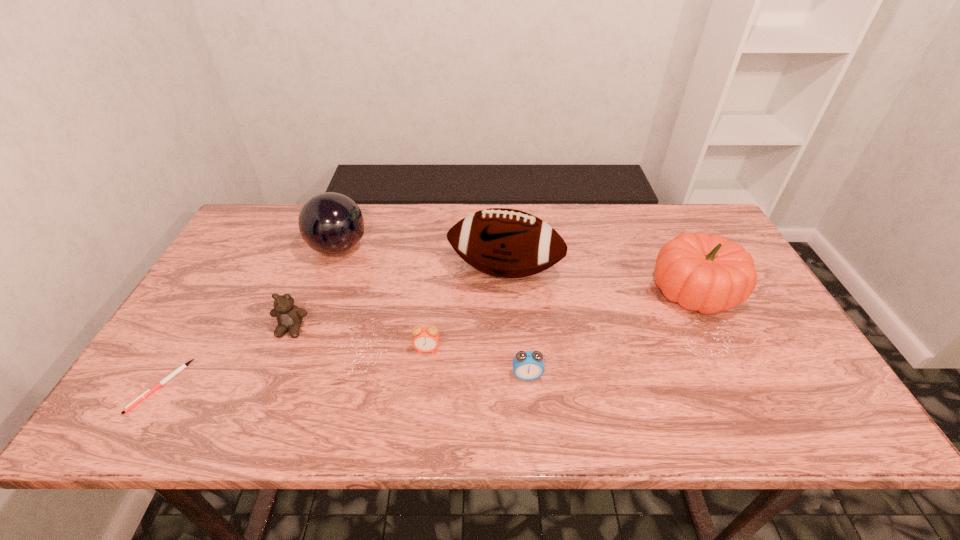
I want to click on vacant space in between the bowling ball and the right alarm clock, so click(433, 312).

Find the location of a particular element. The height and width of the screenshot is (540, 960). free space between the leftmost object and the bowling ball is located at coordinates (250, 317).

Where is `free spot between the teddy bear and the pen`? The height and width of the screenshot is (540, 960). free spot between the teddy bear and the pen is located at coordinates (226, 357).

Where is `free space between the pen and the right alarm clock`? The image size is (960, 540). free space between the pen and the right alarm clock is located at coordinates coord(344,381).

Locate an element on the screen. unoccupied position between the football (American) and the shortest object is located at coordinates (332, 328).

Locate an element on the screen. This screenshot has width=960, height=540. free space between the football (American) and the pen is located at coordinates (332, 328).

What are the coordinates of `free space between the bowling ball and the teddy bear` in the screenshot? It's located at (315, 288).

Where is `object that can be found as the closest to the second shortest object`? This screenshot has height=540, width=960. object that can be found as the closest to the second shortest object is located at coordinates (425, 339).

Identify which object is located as the nearest to the nearer alarm clock. Please provide its 2D coordinates. Your answer should be formatted as a tuple, i.e. [(x, y)], where the tuple contains the x and y coordinates of a point satisfying the conditions above.

[(425, 339)]

This screenshot has height=540, width=960. What are the coordinates of `free space that satisfies the following two spatial constraints: 1. on the side of the bowling ball with the finger holes; 2. on the left side of the pumpkin` in the screenshot? It's located at (323, 292).